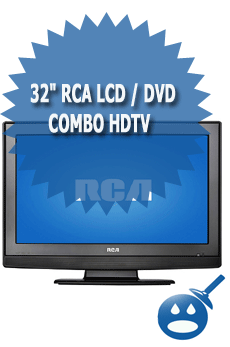
This screenshot has width=230, height=347. In order to click on television in this screenshot , I will do `click(160, 231)`.